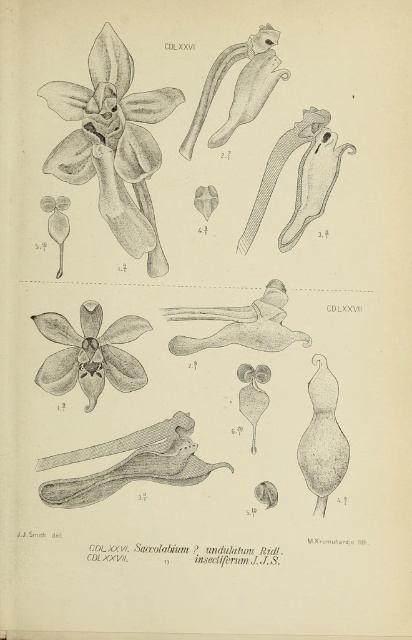
Question: Where is matte black orchid at upper left located in relation to smooth gray stem at lower center in the image?

Choices:
 (A) above
 (B) below

Answer: (A)

Question: Among these objects, which one is nearest to the camera?

Choices:
 (A) smooth gray stem at lower center
 (B) matte black orchid at center

Answer: (A)

Question: Is matte black orchid at upper left thinner than matte black orchid at center?

Choices:
 (A) no
 (B) yes

Answer: (A)

Question: Can you confirm if black line drawing orchid at upper left is bigger than matte black orchid at center?

Choices:
 (A) no
 (B) yes

Answer: (B)

Question: Which of the following is the farthest from the observer?

Choices:
 (A) smooth gray stem at lower center
 (B) matte black orchid at center
 (C) black line drawing orchid at upper left
 (D) matte black orchid at upper left

Answer: (B)

Question: Which object is the farthest from the smooth gray stem at lower center?

Choices:
 (A) matte black orchid at center
 (B) matte black orchid at upper left

Answer: (B)